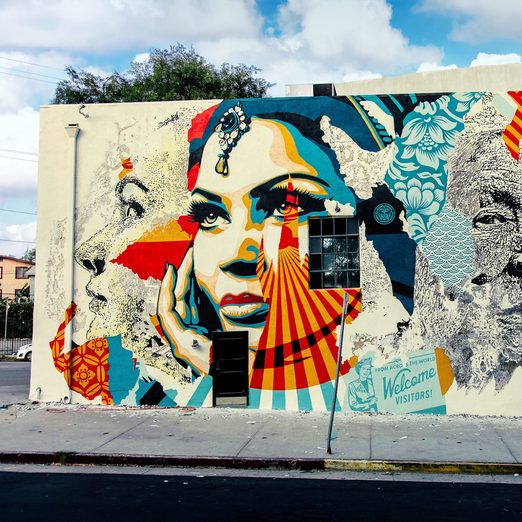
Where is `mural lips`? This screenshot has height=522, width=522. mural lips is located at coordinates (244, 308).